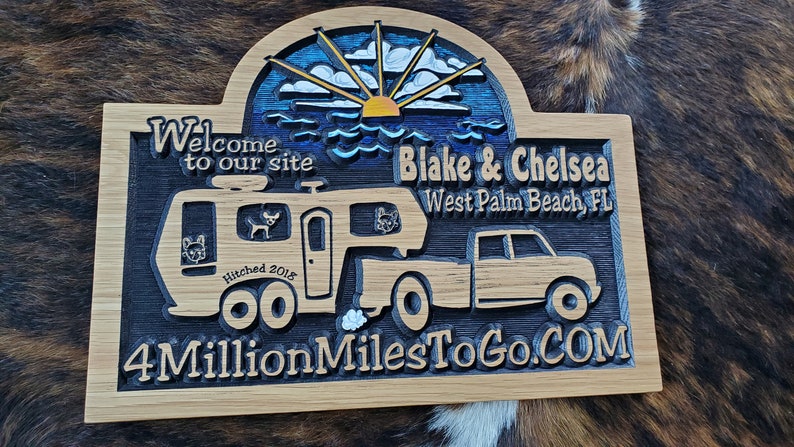
Where is `doornob`? doornob is located at coordinates (310, 259).